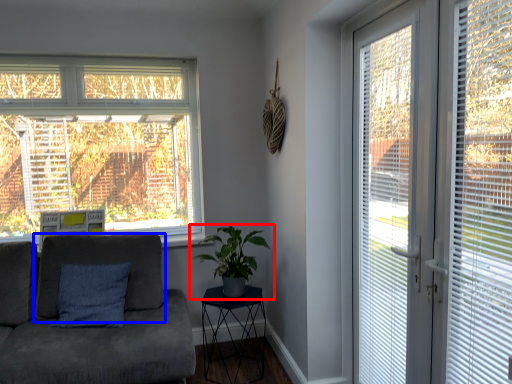
Question: Which of the following is the farthest to the observer, houseplant (highlighted by a red box) or swivel chair (highlighted by a blue box)?

Choices:
 (A) houseplant
 (B) swivel chair

Answer: (B)